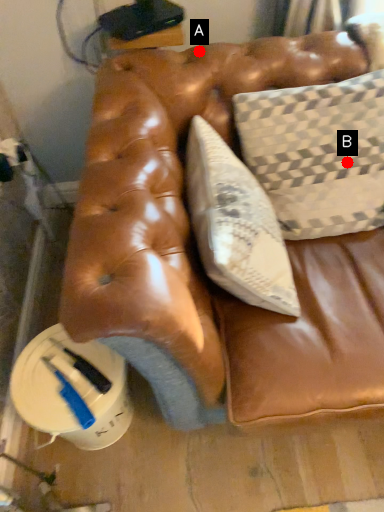
Question: Two points are circled on the image, labeled by A and B beside each circle. Among these points, which one is nearest to the camera?

Choices:
 (A) A is closer
 (B) B is closer

Answer: (B)